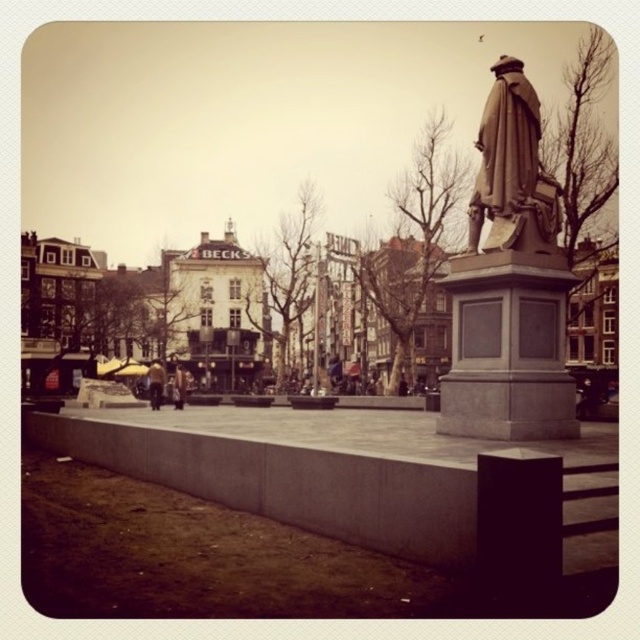
Question: Does bronze statue at center lie in front of dark brown leather jacket at center?

Choices:
 (A) yes
 (B) no

Answer: (A)

Question: Considering the relative positions of bronze statue at right and bronze statue at center in the image provided, where is bronze statue at right located with respect to bronze statue at center?

Choices:
 (A) right
 (B) left

Answer: (B)

Question: Which object appears farthest from the camera in this image?

Choices:
 (A) bronze statue at center
 (B) bronze statue at right

Answer: (A)

Question: Considering the real-world distances, which object is farthest from the bronze statue at right?

Choices:
 (A) bronze statue at center
 (B) concrete at center

Answer: (B)

Question: Which point is farther to the camera?

Choices:
 (A) (545, 317)
 (B) (358, 461)

Answer: (A)

Question: Where is bronze statue at right located in relation to brown leather jacket at center in the image?

Choices:
 (A) right
 (B) left

Answer: (A)